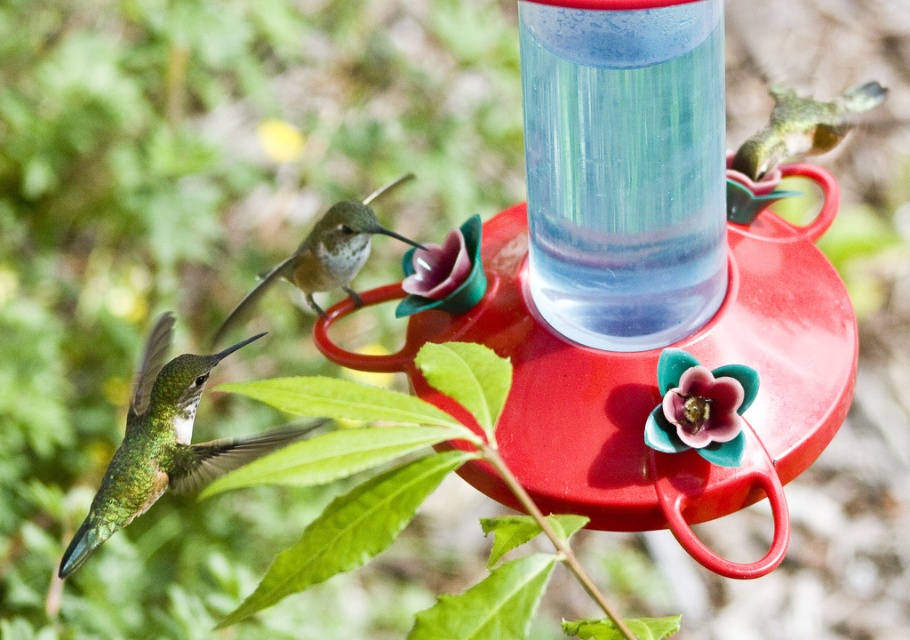
Question: Is green iridescent hummingbird at left to the left of pink glossy flower at center from the viewer's perspective?

Choices:
 (A) yes
 (B) no

Answer: (A)

Question: Is pink glossy flower at center wider than green iridescent feathers at center?

Choices:
 (A) no
 (B) yes

Answer: (A)

Question: Which point is closer to the camera taking this photo?

Choices:
 (A) (458, 241)
 (B) (157, 419)
 (C) (339, 209)
 (D) (744, 400)

Answer: (B)

Question: Which point is closer to the camera taking this photo?

Choices:
 (A) (110, 483)
 (B) (691, 372)

Answer: (A)

Question: Which of the following is the closest to the observer?

Choices:
 (A) green iridescent hummingbird at left
 (B) red plastic bird feeder at center
 (C) green iridescent feathers at center

Answer: (B)

Question: In this image, where is red plastic bird feeder at center located relative to pink glossy flower at center?

Choices:
 (A) above
 (B) below

Answer: (A)